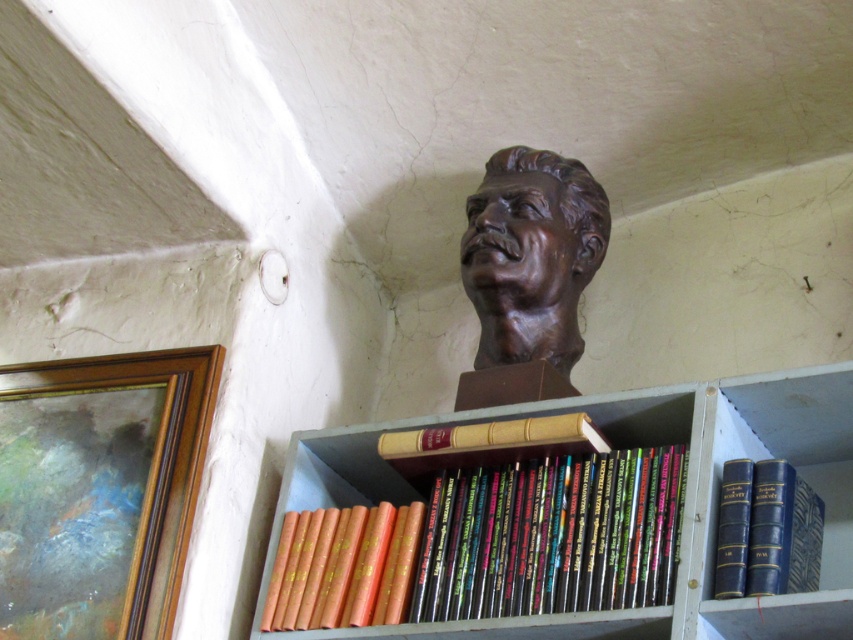
You are an interior designer arranging items in the room. You need to place a new decorative item between the hardcover books at center and the bronze bust at upper center. Based on their positions, where should you place the item?

Since the hardcover books at center are below the bronze bust at upper center, you should place the new decorative item between them vertically. Position it above the hardcover books at center and below the bronze bust at upper center to maintain the vertical arrangement.